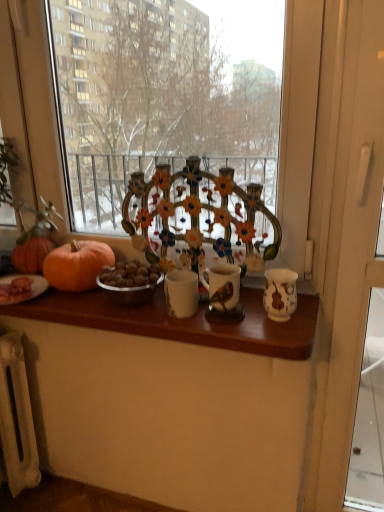
This screenshot has height=512, width=384. I want to click on free area below wooden table at center (from a real-world perspective), so click(x=92, y=494).